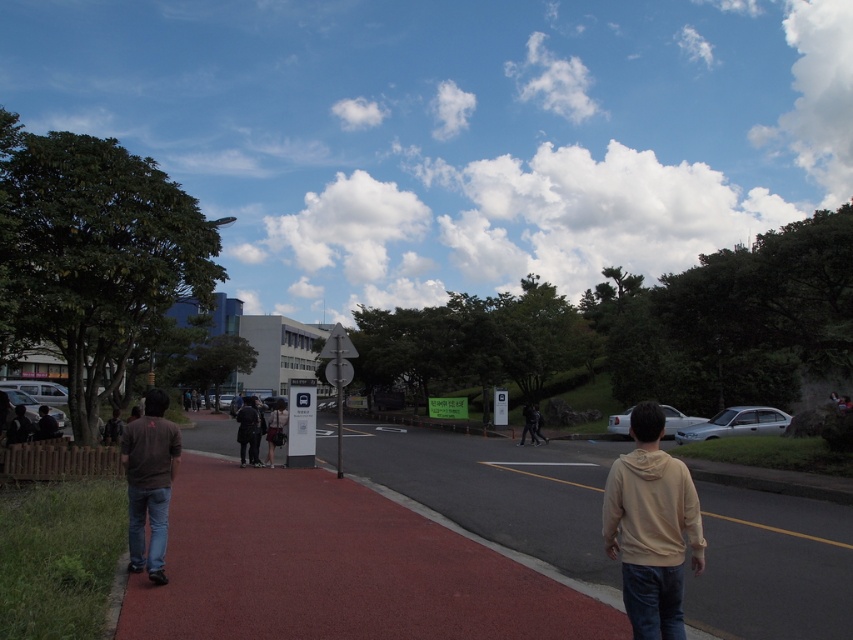
Does red rubber pavement at center have a lesser height compared to beige hoodie at center?

Indeed, red rubber pavement at center has a lesser height compared to beige hoodie at center.

In the scene shown: Between red rubber pavement at center and beige hoodie at center, which one appears on the left side from the viewer's perspective?

red rubber pavement at center is more to the left.

Which is behind, point (454, 474) or point (618, 502)?

The point (454, 474) is more distant.

You are a GUI agent. You are given a task and a screenshot of the screen. Output one action in this format:
    pyautogui.click(x=<x>, y=<y>)
    Task: Click on the red rubber pavement at center
    The height and width of the screenshot is (640, 853).
    Given the screenshot: What is the action you would take?
    498,488

Which is behind, point (419, 429) or point (144, 486)?

The point (419, 429) is behind.

Find the location of a particular element. red rubber pavement at center is located at coordinates (498, 488).

Between beige hoodie at center and dark brown shirt at left, which one has more height?

beige hoodie at center

In order to click on beige hoodie at center in this screenshot , I will do `click(651, 528)`.